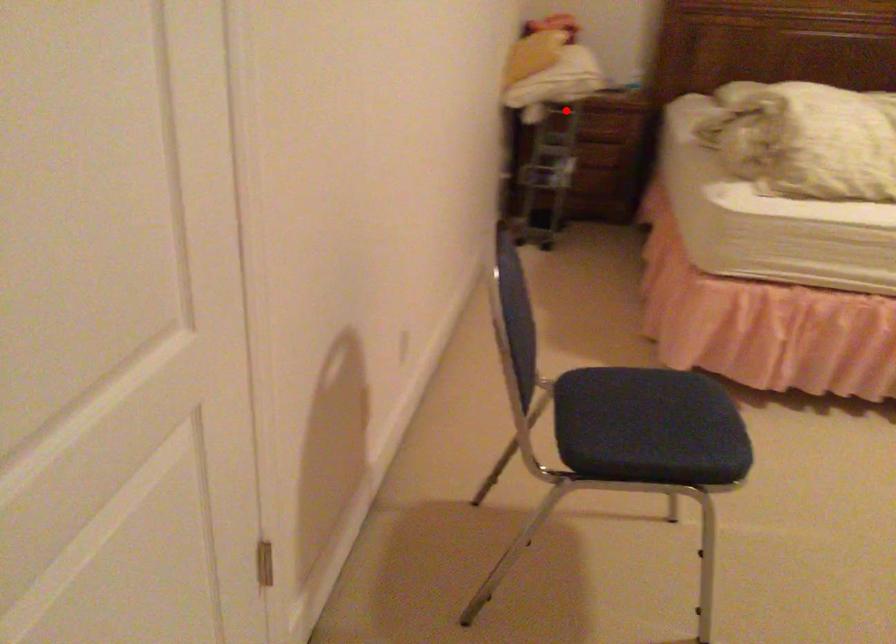
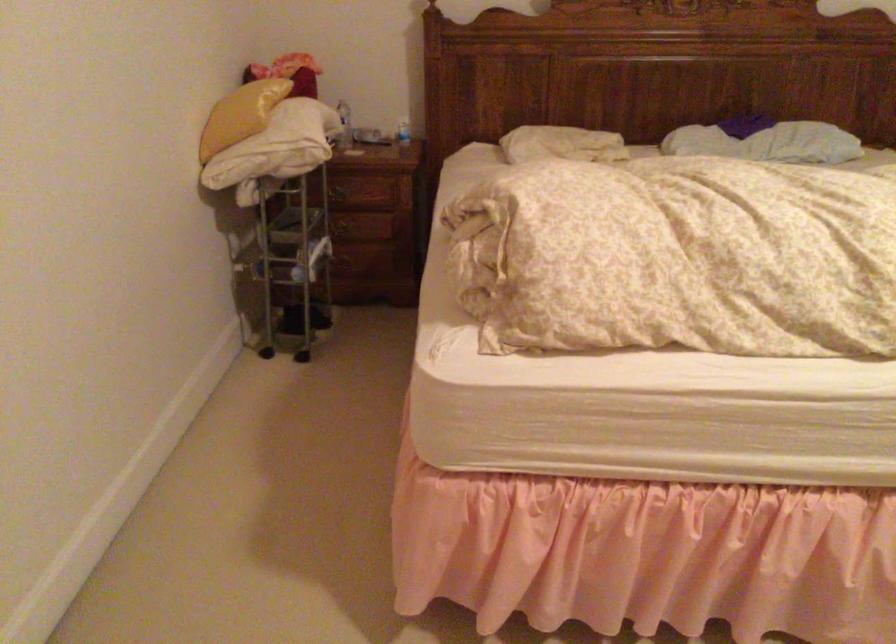
Question: I am providing you with two images of the same scene from different viewpoints. Given a red point in image1, look at the same physical point in image2. Is it:

Choices:
 (A) Closer to the viewpoint
 (B) Farther from the viewpoint

Answer: (A)